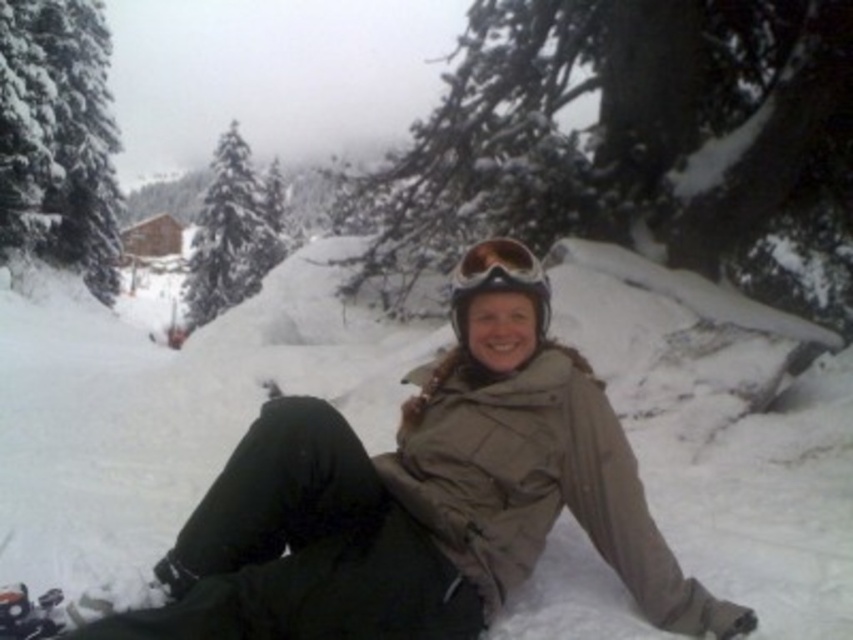
Does green matte pine at upper left have a smaller size compared to matte black goggles at center?

Incorrect, green matte pine at upper left is not smaller in size than matte black goggles at center.

Does point (239, 272) come farther from viewer compared to point (474, 284)?

Yes, it is.

Does point (247, 196) lie in front of point (525, 269)?

No.

The image size is (853, 640). I want to click on green matte pine at upper left, so click(x=231, y=232).

Can you confirm if white fluffy snow at center is positioned below green matte pine at upper left?

Correct, white fluffy snow at center is located below green matte pine at upper left.

Can you confirm if white fluffy snow at center is smaller than green matte pine at upper left?

Yes.

Locate an element on the screen. white fluffy snow at center is located at coordinates (167, 410).

The width and height of the screenshot is (853, 640). What are the coordinates of `white fluffy snow at center` in the screenshot? It's located at (167, 410).

Is white fluffy snow at center below matte black goggles at center?

Indeed, white fluffy snow at center is positioned under matte black goggles at center.

Is the position of white fluffy snow at center more distant than that of matte black goggles at center?

No, white fluffy snow at center is closer to the viewer.

Does point (97, 420) come farther from viewer compared to point (531, 285)?

Yes, it is behind point (531, 285).

Image resolution: width=853 pixels, height=640 pixels. What are the coordinates of `white fluffy snow at center` in the screenshot? It's located at (167, 410).